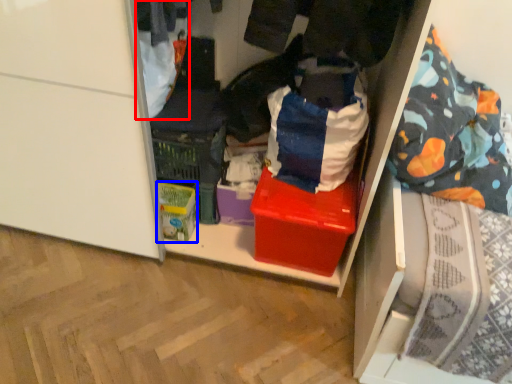
Question: Which point is further to the camera, clothing (highlighted by a red box) or storage box (highlighted by a blue box)?

Choices:
 (A) clothing
 (B) storage box

Answer: (B)